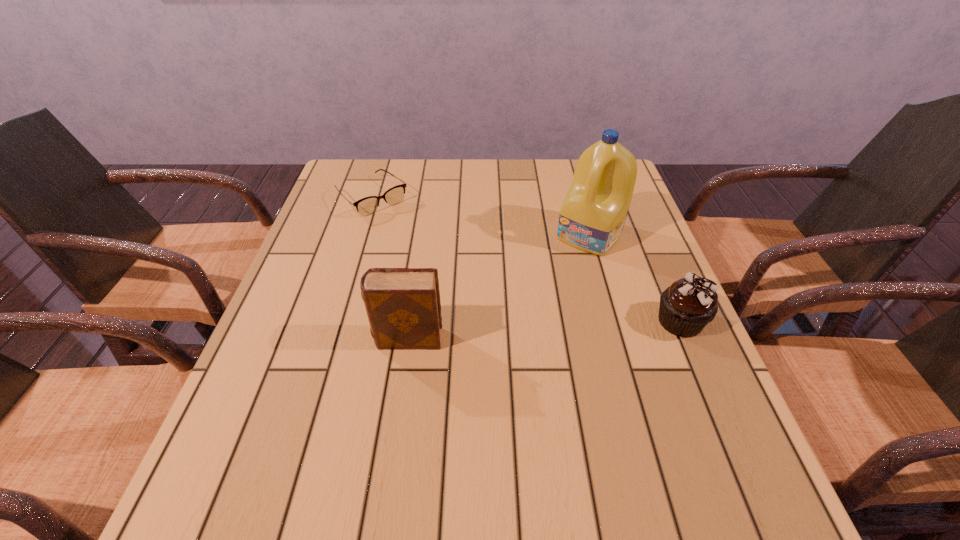
This screenshot has width=960, height=540. I want to click on blank area at the near edge, so click(637, 421).

Find the location of a particular element. vacant area at the left edge is located at coordinates (342, 246).

In the image, there is a desktop. Where is `vacant space at the right edge`? vacant space at the right edge is located at coordinates (656, 285).

This screenshot has height=540, width=960. Identify the location of free location at the near left corner of the desktop. (301, 411).

Identify the location of vacant space at the near right corner of the desktop. The image size is (960, 540). (656, 408).

This screenshot has height=540, width=960. In order to click on empty space that is in between the second shortest object and the diary in this screenshot , I will do `click(544, 330)`.

Where is `blank region between the second tallest object and the cupcake`? blank region between the second tallest object and the cupcake is located at coordinates (544, 330).

At what (x,y) coordinates should I click in order to perform the action: click on blank region between the tallest object and the third shortest object. Please return your answer as a coordinate pair (x, y). This screenshot has height=540, width=960. Looking at the image, I should click on (498, 287).

The width and height of the screenshot is (960, 540). I want to click on free space between the diary and the spectacles, so click(x=390, y=268).

At what (x,y) coordinates should I click in order to perform the action: click on unoccupied area between the diary and the detergent. Please return your answer as a coordinate pair (x, y). This screenshot has width=960, height=540. Looking at the image, I should click on (498, 287).